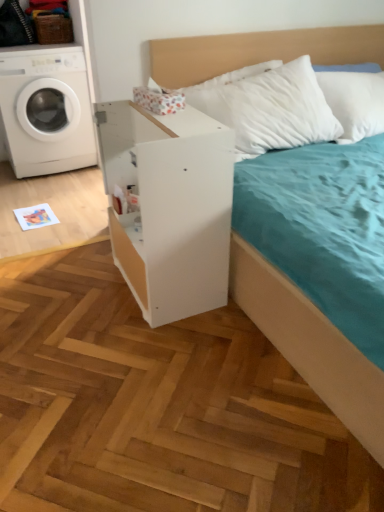
Question: Would you say white glossy washing machine at left is inside or outside white matte dresser at center?

Choices:
 (A) outside
 (B) inside

Answer: (A)

Question: In the image, is white glossy washing machine at left positioned in front of or behind white matte dresser at center?

Choices:
 (A) front
 (B) behind

Answer: (B)

Question: From a real-world perspective, is white glossy washing machine at left positioned above or below white matte dresser at center?

Choices:
 (A) below
 (B) above

Answer: (B)

Question: Is white matte dresser at center bigger or smaller than white glossy washing machine at left?

Choices:
 (A) small
 (B) big

Answer: (A)

Question: From a real-world perspective, is white matte dresser at center physically located above or below white glossy washing machine at left?

Choices:
 (A) below
 (B) above

Answer: (A)

Question: Considering the positions of white matte dresser at center and white glossy washing machine at left in the image, is white matte dresser at center taller or shorter than white glossy washing machine at left?

Choices:
 (A) short
 (B) tall

Answer: (A)

Question: Considering the positions of point (153, 309) and point (61, 133), is point (153, 309) closer or farther from the camera than point (61, 133)?

Choices:
 (A) closer
 (B) farther

Answer: (A)